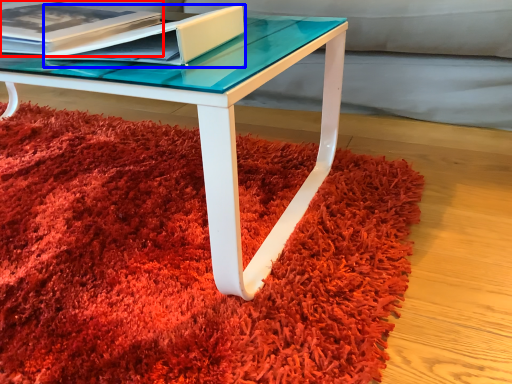
Question: Among these objects, which one is nearest to the camera, paperback book (highlighted by a red box) or paperback book (highlighted by a blue box)?

Choices:
 (A) paperback book
 (B) paperback book

Answer: (B)